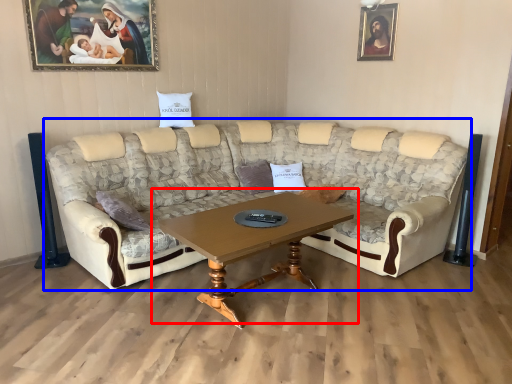
Question: Which of the following is the farthest to the observer, coffee table (highlighted by a red box) or studio couch (highlighted by a blue box)?

Choices:
 (A) coffee table
 (B) studio couch

Answer: (A)